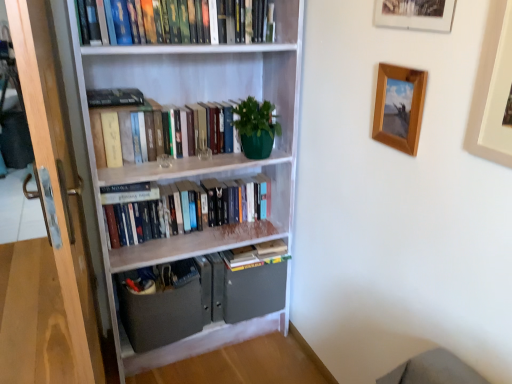
The height and width of the screenshot is (384, 512). Describe the element at coordinates (187, 210) in the screenshot. I see `hardcover books at center, arranged as the 3th book when viewed from the top` at that location.

Describe the element at coordinates (160, 314) in the screenshot. I see `matte gray cabinet at lower center` at that location.

The height and width of the screenshot is (384, 512). Find the location of `matte gray cabinet at lower center`. matte gray cabinet at lower center is located at coordinates (160, 314).

The width and height of the screenshot is (512, 384). What do you see at coordinates (399, 108) in the screenshot?
I see `wooden picture frame at upper right, placed as the 1th picture frame when sorted from left to right` at bounding box center [399, 108].

This screenshot has height=384, width=512. Identify the location of hardcover books at upper center, which is counted as the first book, starting from the top. (175, 21).

You are a GUI agent. You are given a task and a screenshot of the screen. Output one action in this format:
    pyautogui.click(x=<x>, y=<y>)
    Task: Click on the hardcover books at center, the 2th book viewed from the top
    
    Given the screenshot: What is the action you would take?
    [x=125, y=113]

You are a GUI agent. You are given a task and a screenshot of the screen. Output one action in this format:
    pyautogui.click(x=<x>, y=<y>)
    Task: Click on the wooden screen door at left
    
    Given the screenshot: What is the action you would take?
    pyautogui.click(x=57, y=176)

The image size is (512, 384). What do you see at coordinates (57, 176) in the screenshot? I see `wooden screen door at left` at bounding box center [57, 176].

Find the location of `hardcover books at center, arranged as the 3th book when viewed from the top`. hardcover books at center, arranged as the 3th book when viewed from the top is located at coordinates (187, 210).

From a real-world perspective, who is located lower, wooden picture frame at upper right, arranged as the third picture frame when viewed from the right, or wooden picture frame at upper right, which ranks as the first picture frame in right-to-left order?

wooden picture frame at upper right, arranged as the third picture frame when viewed from the right, is physically lower.

Could wooden picture frame at upper right, acting as the third picture frame starting from the left, be considered to be inside wooden picture frame at upper right, arranged as the third picture frame when viewed from the right?

No, wooden picture frame at upper right, acting as the third picture frame starting from the left, is not surrounded by wooden picture frame at upper right, arranged as the third picture frame when viewed from the right.

Starting from the wooden picture frame at upper right, arranged as the third picture frame when viewed from the right, which picture frame is the 2nd one in front? Please provide its 2D coordinates.

[(493, 90)]

Can you confirm if wooden picture frame at upper right, arranged as the third picture frame when viewed from the right, is shorter than wooden picture frame at upper right, acting as the third picture frame starting from the left?

Correct, wooden picture frame at upper right, arranged as the third picture frame when viewed from the right, is not as tall as wooden picture frame at upper right, acting as the third picture frame starting from the left.

Between wooden picture frame at upper right, which ranks as the first picture frame in right-to-left order, and hardcover books at upper center, which is counted as the first book, starting from the top, which one has larger size?

hardcover books at upper center, which is counted as the first book, starting from the top.

Between wooden picture frame at upper right, which ranks as the first picture frame in right-to-left order, and hardcover books at upper center, which is counted as the first book, starting from the top, which one has less height?

With less height is hardcover books at upper center, which is counted as the first book, starting from the top.

Which object is further away from the camera, wooden picture frame at upper right, acting as the third picture frame starting from the left, or hardcover books at upper center, which is counted as the first book, starting from the top?

Positioned behind is hardcover books at upper center, which is counted as the first book, starting from the top.

Who is taller, wooden picture frame at upper center, the second picture frame viewed from the right, or hardcover books at center, which is the second book in bottom-to-top order?

wooden picture frame at upper center, the second picture frame viewed from the right, is taller.

Locate an element on the screen. The height and width of the screenshot is (384, 512). the 3rd book below the wooden picture frame at upper center, the second picture frame viewed from the right (from a real-world perspective) is located at coordinates (187, 210).

In the scene shown: Considering the positions of objects wooden picture frame at upper center, the 2th picture frame when ordered from left to right, and hardcover books at center, arranged as the 3th book when viewed from the top, in the image provided, who is more to the left, wooden picture frame at upper center, the 2th picture frame when ordered from left to right, or hardcover books at center, arranged as the 3th book when viewed from the top,?

hardcover books at center, arranged as the 3th book when viewed from the top.

Consider the image. Is wooden picture frame at upper center, the 2th picture frame when ordered from left to right, not close to hardcover books at center, arranged as the 3th book when viewed from the top?

Absolutely, wooden picture frame at upper center, the 2th picture frame when ordered from left to right, is distant from hardcover books at center, arranged as the 3th book when viewed from the top.

Is wooden screen door at left a part of matte gray cabinet at lower center?

No, wooden screen door at left is located outside of matte gray cabinet at lower center.

Is matte gray cabinet at lower center far away from wooden screen door at left?

No.

Based on the photo, in terms of height, does matte gray cabinet at lower center look taller or shorter compared to wooden screen door at left?

In the image, matte gray cabinet at lower center appears to be shorter than wooden screen door at left.

Based on their positions, is matte gray cabinet at lower center located to the left or right of wooden screen door at left?

matte gray cabinet at lower center is positioned on wooden screen door at left's right side.

Would you say hardcover books at center, the 1th book positioned from the bottom, is part of hardcover books at center, which appears as the third book when ordered from the bottom,'s contents?

Actually, hardcover books at center, the 1th book positioned from the bottom, is outside hardcover books at center, which appears as the third book when ordered from the bottom.

Is point (152, 112) positioned behind point (230, 250)?

That is False.

From a real-world perspective, is hardcover books at center, which appears as the third book when ordered from the bottom, above or below hardcover books at center, marked as the 4th book in a top-to-bottom arrangement?

From a real-world perspective, hardcover books at center, which appears as the third book when ordered from the bottom, is physically above hardcover books at center, marked as the 4th book in a top-to-bottom arrangement.

Which is in front, hardcover books at center, the 2th book viewed from the top, or hardcover books at center, marked as the 4th book in a top-to-bottom arrangement?

hardcover books at center, the 2th book viewed from the top, is closer to the camera.

Visually, is hardcover books at center, which is the second book in bottom-to-top order, positioned to the left or to the right of matte gray cabinet at lower center?

Based on their positions, hardcover books at center, which is the second book in bottom-to-top order, is located to the right of matte gray cabinet at lower center.

From the image's perspective, is hardcover books at center, arranged as the 3th book when viewed from the top, on top of matte gray cabinet at lower center?

Yes, from the image's perspective, hardcover books at center, arranged as the 3th book when viewed from the top, is over matte gray cabinet at lower center.

The height and width of the screenshot is (384, 512). In order to click on the 2nd book above when counting from the matte gray cabinet at lower center (from the image's perspective) in this screenshot , I will do `click(187, 210)`.

Looking at this image, from the image's perspective, is hardcover books at center, arranged as the 3th book when viewed from the top, beneath white matte bookcase at center?

Correct, hardcover books at center, arranged as the 3th book when viewed from the top, appears lower than white matte bookcase at center in the image.

Is hardcover books at center, arranged as the 3th book when viewed from the top, to the left or to the right of white matte bookcase at center in the image?

hardcover books at center, arranged as the 3th book when viewed from the top, is to the left of white matte bookcase at center.

At what (x,y) coordinates should I click in order to perform the action: click on picture frame below the wooden picture frame at upper right, acting as the third picture frame starting from the left (from a real-world perspective). Please return your answer as a coordinate pair (x, y). The height and width of the screenshot is (384, 512). Looking at the image, I should click on (399, 108).

Locate an element on the screen. The height and width of the screenshot is (384, 512). book above the wooden picture frame at upper right, which ranks as the first picture frame in right-to-left order (from a real-world perspective) is located at coordinates (175, 21).

When comparing their distances from wooden picture frame at upper right, which ranks as the first picture frame in right-to-left order, does hardcover books at center, the 2th book viewed from the top, or wooden picture frame at upper right, arranged as the third picture frame when viewed from the right, seem closer?

wooden picture frame at upper right, arranged as the third picture frame when viewed from the right, lies closer to wooden picture frame at upper right, which ranks as the first picture frame in right-to-left order, than the other object.

Considering their positions, is wooden picture frame at upper right, which ranks as the first picture frame in right-to-left order, positioned closer to hardcover books at center, the 2th book viewed from the top, than hardcover books at center, arranged as the 3th book when viewed from the top?

hardcover books at center, arranged as the 3th book when viewed from the top, lies closer to hardcover books at center, the 2th book viewed from the top, than the other object.

Estimate the real-world distances between objects in this image. Which object is closer to hardcover books at center, arranged as the 3th book when viewed from the top, hardcover books at center, which appears as the third book when ordered from the bottom, or wooden picture frame at upper center, the 2th picture frame when ordered from left to right?

hardcover books at center, which appears as the third book when ordered from the bottom.

Which object lies nearer to the anchor point wooden picture frame at upper right, which ranks as the first picture frame in right-to-left order, matte gray cabinet at lower center or wooden picture frame at upper center, the 2th picture frame when ordered from left to right?

The object closer to wooden picture frame at upper right, which ranks as the first picture frame in right-to-left order, is wooden picture frame at upper center, the 2th picture frame when ordered from left to right.

Which object lies further to the anchor point hardcover books at center, the 1th book positioned from the bottom, hardcover books at center, which appears as the third book when ordered from the bottom, or hardcover books at upper center, the 4th book ordered from the bottom?

hardcover books at upper center, the 4th book ordered from the bottom, lies further to hardcover books at center, the 1th book positioned from the bottom, than the other object.

When comparing their distances from wooden picture frame at upper right, arranged as the third picture frame when viewed from the right, does wooden picture frame at upper center, the second picture frame viewed from the right, or matte gray cabinet at lower center seem further?

Among the two, matte gray cabinet at lower center is located further to wooden picture frame at upper right, arranged as the third picture frame when viewed from the right.

Estimate the real-world distances between objects in this image. Which object is further from wooden picture frame at upper center, the second picture frame viewed from the right, hardcover books at upper center, the 4th book ordered from the bottom, or matte gray cabinet at lower center?

matte gray cabinet at lower center.

Estimate the real-world distances between objects in this image. Which object is closer to wooden picture frame at upper right, placed as the 1th picture frame when sorted from left to right, matte gray cabinet at lower center or wooden picture frame at upper right, which ranks as the first picture frame in right-to-left order?

wooden picture frame at upper right, which ranks as the first picture frame in right-to-left order, is positioned closer to the anchor wooden picture frame at upper right, placed as the 1th picture frame when sorted from left to right.

This screenshot has width=512, height=384. Identify the location of bookcase between hardcover books at upper center, which is counted as the first book, starting from the top, and wooden picture frame at upper right, acting as the third picture frame starting from the left. (185, 151).

Locate an element on the screen. bookcase between wooden picture frame at upper right, which ranks as the first picture frame in right-to-left order, and hardcover books at center, which appears as the third book when ordered from the bottom, along the z-axis is located at coordinates (185, 151).

Where is `drawer between wooden picture frame at upper right, which ranks as the first picture frame in right-to-left order, and hardcover books at center, the 1th book positioned from the bottom, from front to back`? drawer between wooden picture frame at upper right, which ranks as the first picture frame in right-to-left order, and hardcover books at center, the 1th book positioned from the bottom, from front to back is located at coordinates (160, 314).

This screenshot has height=384, width=512. I want to click on picture frame between wooden screen door at left and wooden picture frame at upper center, the 2th picture frame when ordered from left to right, so click(399, 108).